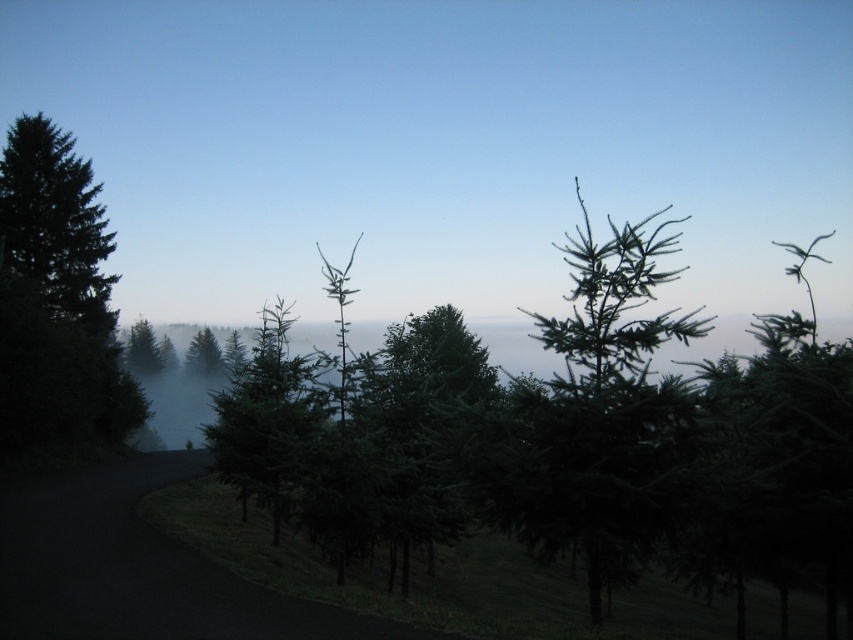
In the scene shown: You are driving along the dark road in the foreground and notice two green matte trees at left and a green matte tree at center. Which group of trees is bigger in size?

The green matte trees at left has a larger size compared to the green matte tree at center.

You are standing at the point marked by the coordinates point (606,401), which is labeled as green needle like tree at center. You want to walk straight ahead. Given the road curves to the left, which direction should you walk to stay on the road?

Since the road curves to the left and you are at the green needle like tree at center located at point (606,401), you should walk to the left to stay on the road.